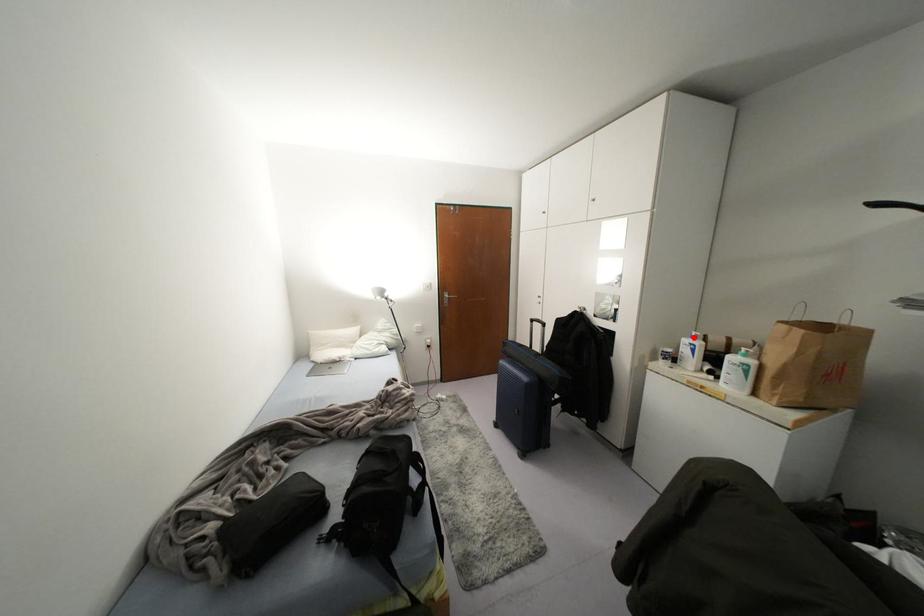
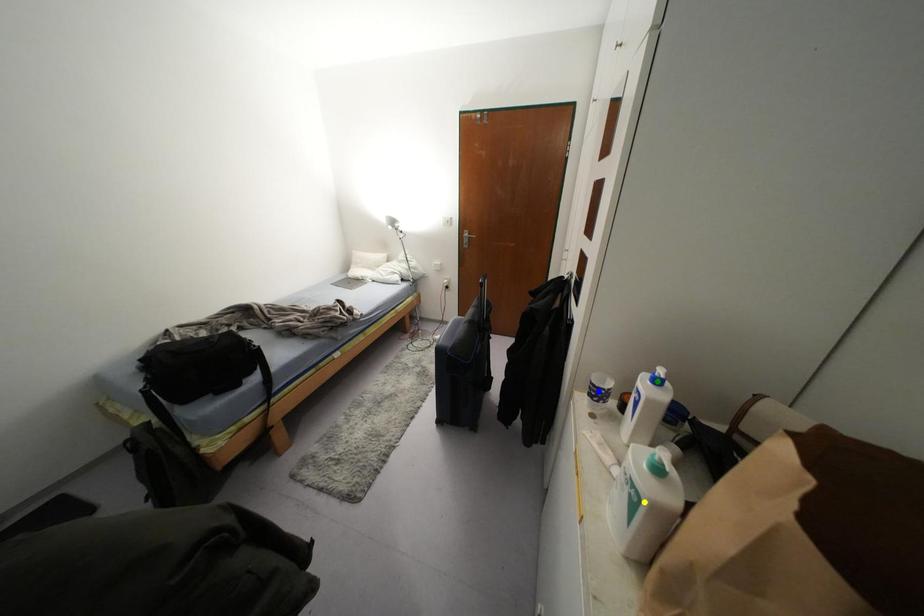
Question: I am providing you with two images of the same scene from different viewpoints. A red point is marked on the first image. You are given multiple points on the second image. Which mark in image 2 goes with the point in image 1?

Choices:
 (A) yellow point
 (B) green point
 (C) blue point

Answer: (B)